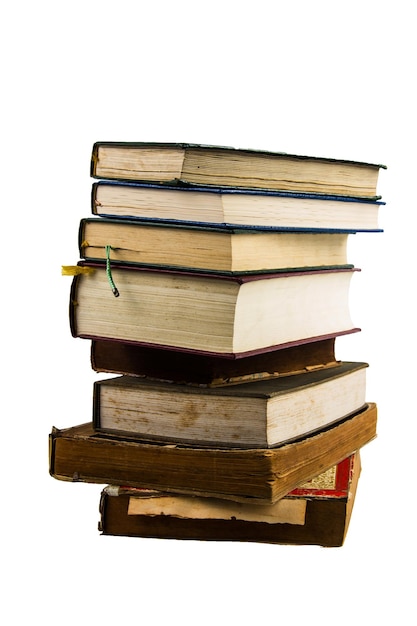
Locate an element on the screen. The image size is (417, 626). books is located at coordinates tap(150, 156), tap(204, 203), tap(180, 254), tap(187, 304), tap(172, 367), tap(175, 414), tap(193, 463), tap(169, 521).